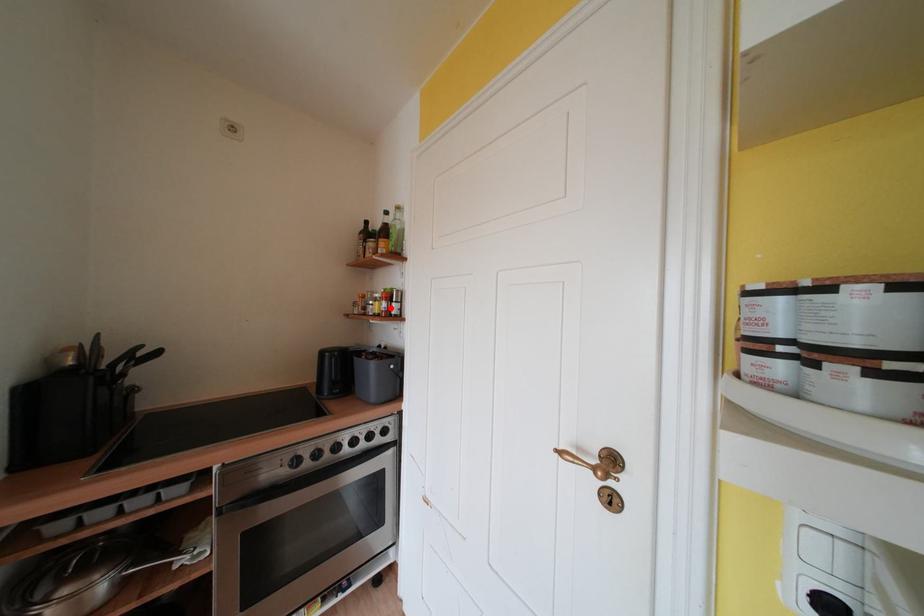
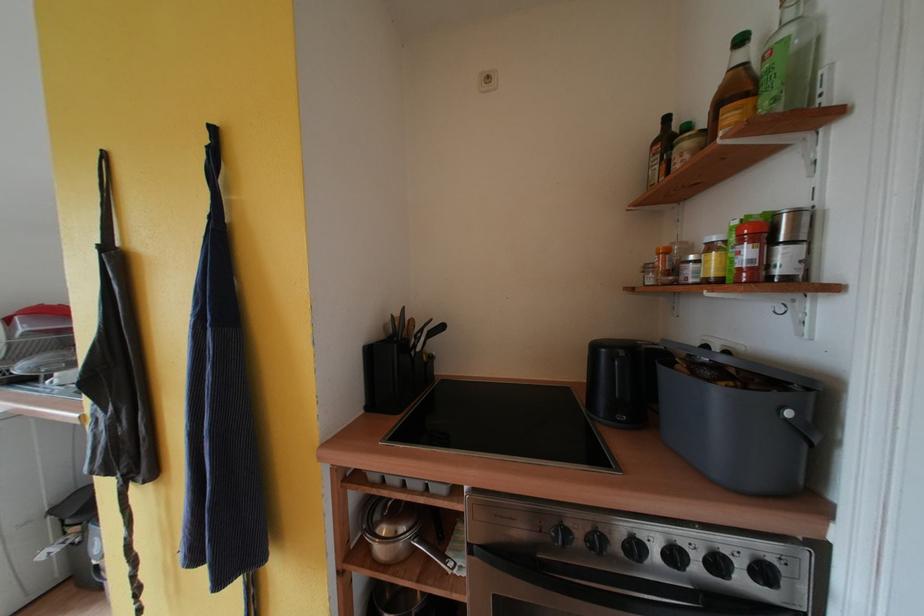
In the second image, find the point that corresponds to the highlighted location in the first image.

(755, 256)